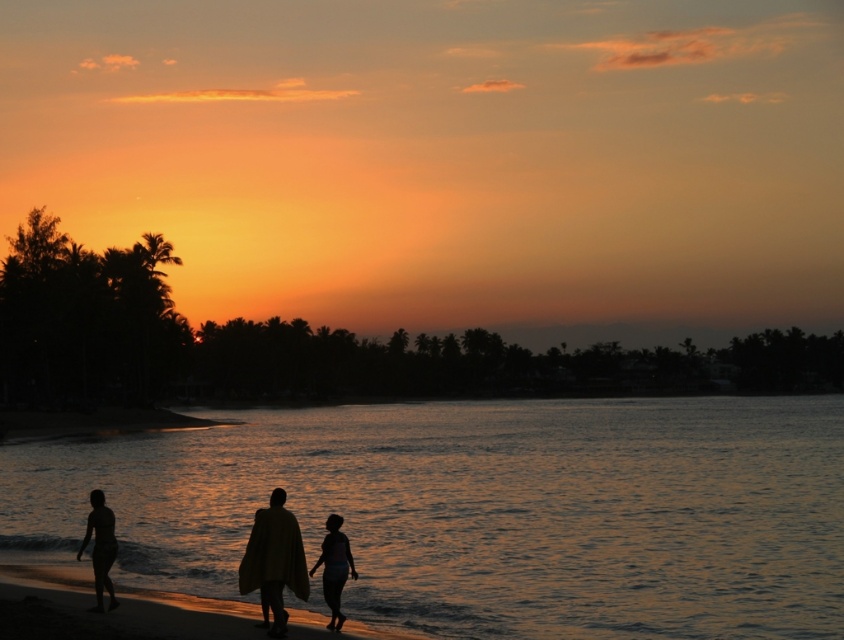
Is silhouette skin at lower left smaller than silhouette figure at lower center?

Actually, silhouette skin at lower left might be larger than silhouette figure at lower center.

Find the location of a particular element. Image resolution: width=844 pixels, height=640 pixels. silhouette skin at lower left is located at coordinates (100, 547).

Is point (100, 556) in front of point (331, 593)?

No, (100, 556) is further to viewer.

You are a GUI agent. You are given a task and a screenshot of the screen. Output one action in this format:
    pyautogui.click(x=<x>, y=<y>)
    Task: Click on the silhouette skin at lower left
    This screenshot has width=844, height=640.
    Given the screenshot: What is the action you would take?
    pyautogui.click(x=100, y=547)

Is silhouette fabric at center further to the viewer compared to silhouette figure at lower center?

No, silhouette fabric at center is in front of silhouette figure at lower center.

Does silhouette fabric at center have a lesser width compared to silhouette figure at lower center?

In fact, silhouette fabric at center might be wider than silhouette figure at lower center.

Is point (336, 593) positioned after point (328, 573)?

Yes, point (336, 593) is farther from viewer.

Where is `silhouette fabric at center`? silhouette fabric at center is located at coordinates (274, 560).

Which is above, silhouette fabric at center or silhouette skin at lower left?

silhouette fabric at center is higher up.

The width and height of the screenshot is (844, 640). What do you see at coordinates (274, 560) in the screenshot?
I see `silhouette fabric at center` at bounding box center [274, 560].

Is point (252, 582) positioned after point (100, 561)?

No, (252, 582) is in front of (100, 561).

At what (x,y) coordinates should I click in order to perform the action: click on silhouette fabric at center. Please return your answer as a coordinate pair (x, y). The width and height of the screenshot is (844, 640). Looking at the image, I should click on (274, 560).